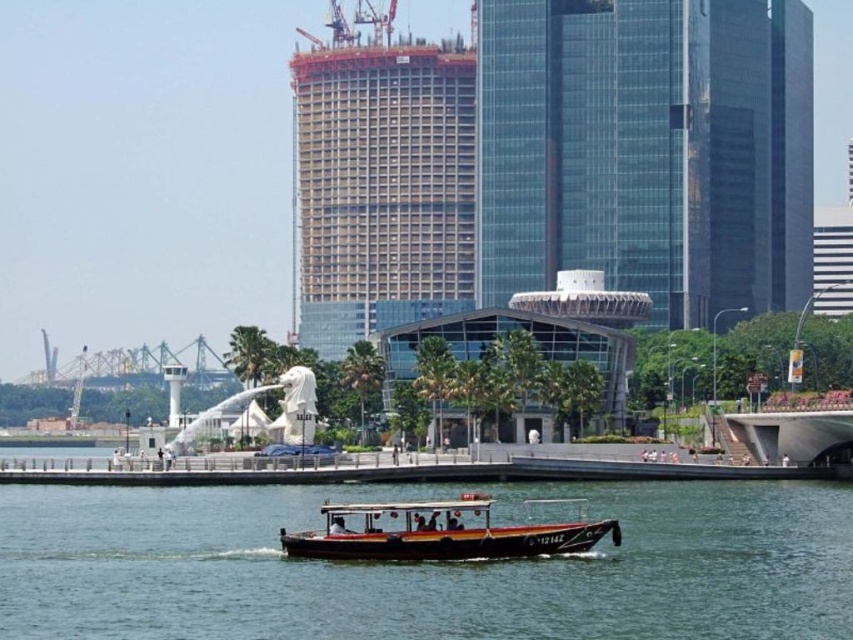
Question: Which point is closer to the camera taking this photo?

Choices:
 (A) (570, 589)
 (B) (532, 532)
 (C) (521, 276)

Answer: (A)

Question: Which point is farther from the camera taking this photo?

Choices:
 (A) (334, 292)
 (B) (636, 493)
 (C) (575, 136)
 (D) (370, 516)

Answer: (A)

Question: Does concrete frame building at center appear under wooden polished boat at center?

Choices:
 (A) yes
 (B) no

Answer: (B)

Question: From the image, what is the correct spatial relationship of green water at center in relation to transparent glass skyscraper at center?

Choices:
 (A) left
 (B) right

Answer: (A)

Question: Which point is farther to the camera?

Choices:
 (A) (427, 289)
 (B) (407, 515)
 (C) (735, 42)
 (D) (271, 486)

Answer: (A)

Question: Is green water at center further to camera compared to concrete frame building at center?

Choices:
 (A) yes
 (B) no

Answer: (B)